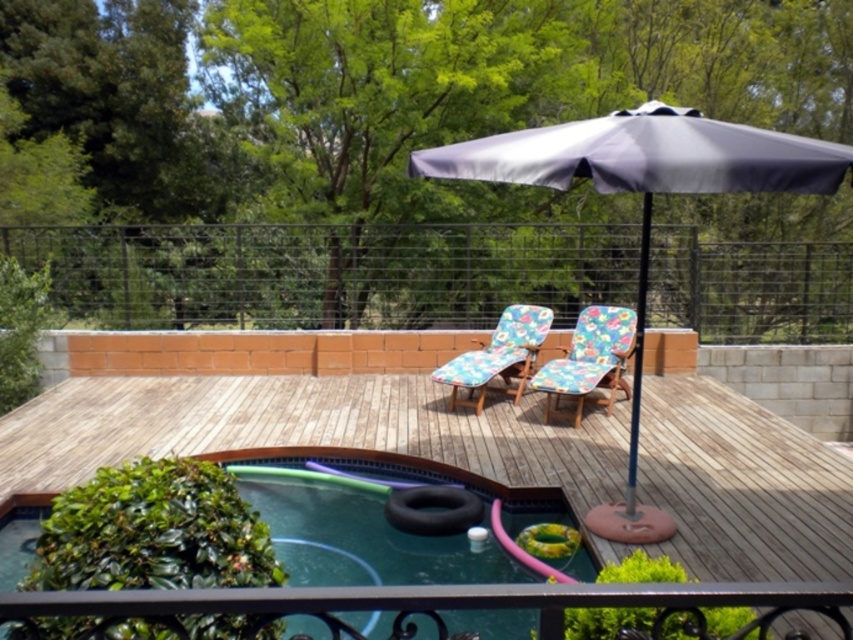
Question: Estimate the real-world distances between objects in this image. Which object is farther from the gray fabric umbrella at upper center?

Choices:
 (A) black metal rail at lower center
 (B) floral fabric chair at center
 (C) floral fabric beach chair at center
 (D) smooth green rubber at lower center

Answer: (C)

Question: Is gray fabric umbrella at upper center to the left of black metal rail at lower center from the viewer's perspective?

Choices:
 (A) no
 (B) yes

Answer: (A)

Question: Is the position of gray fabric umbrella at upper center more distant than that of floral fabric beach chair at center?

Choices:
 (A) yes
 (B) no

Answer: (B)

Question: Which object is the farthest from the floral fabric chair at center?

Choices:
 (A) gray fabric umbrella at upper center
 (B) floral fabric beach chair at center
 (C) smooth green rubber at lower center

Answer: (A)

Question: Which point is farther to the camera?

Choices:
 (A) (297, 589)
 (B) (610, 401)

Answer: (B)

Question: Can you confirm if gray fabric umbrella at upper center is wider than black metal rail at lower center?

Choices:
 (A) yes
 (B) no

Answer: (A)